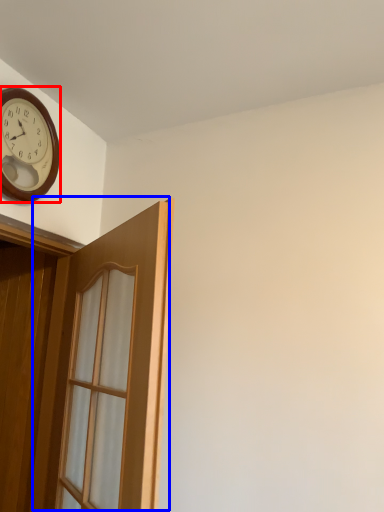
Question: Which of the following is the closest to the observer, clock (highlighted by a red box) or door (highlighted by a blue box)?

Choices:
 (A) clock
 (B) door

Answer: (B)